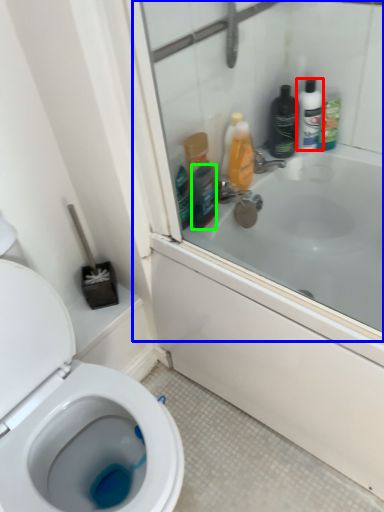
Question: Which object is positioned farthest from toiletry (highlighted by a red box)? Select from screen door (highlighted by a blue box) and mouthwash (highlighted by a green box).

Choices:
 (A) screen door
 (B) mouthwash

Answer: (B)